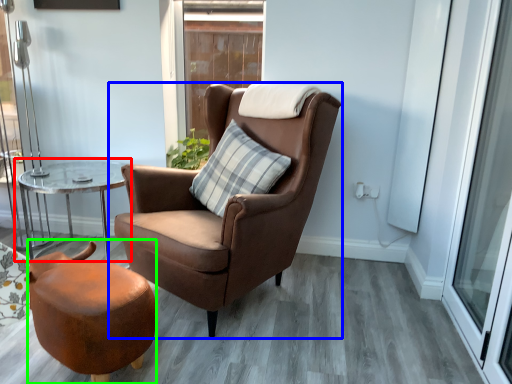
Question: Which object is positioned farthest from table (highlighted by a red box)? Select from chair (highlighted by a blue box) and stool (highlighted by a green box).

Choices:
 (A) chair
 (B) stool

Answer: (B)